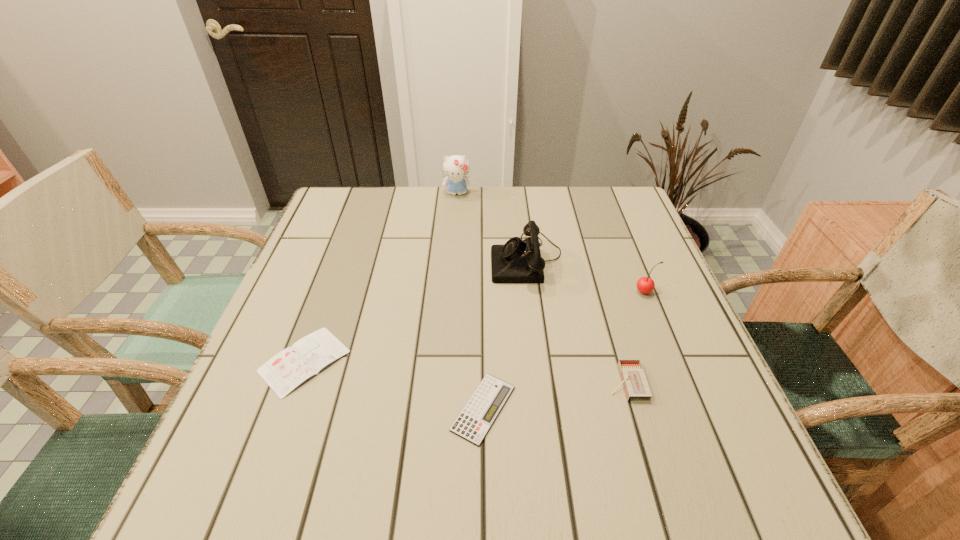
The image size is (960, 540). Find the location of `kitten located in the far edge section of the desktop`. kitten located in the far edge section of the desktop is located at coordinates pyautogui.click(x=456, y=167).

Where is `telephone located at the far edge`? The height and width of the screenshot is (540, 960). telephone located at the far edge is located at coordinates (517, 261).

Identify the location of object at the left edge. (292, 366).

I want to click on cherry at the right edge, so click(645, 285).

I want to click on matchbox that is positioned at the right edge, so click(x=634, y=381).

Locate an element on the screen. vacant point at the far edge is located at coordinates (394, 198).

This screenshot has height=540, width=960. In the image, there is a desktop. What are the coordinates of `vacant area at the near edge` in the screenshot? It's located at point(464,463).

The width and height of the screenshot is (960, 540). In the image, there is a desktop. Identify the location of vacant space at the left edge. (303, 295).

You are a GUI agent. You are given a task and a screenshot of the screen. Output one action in this format:
    pyautogui.click(x=<x>, y=<y>)
    Task: Click on the free region at the right edge
    The image size is (960, 540).
    Given the screenshot: What is the action you would take?
    pyautogui.click(x=650, y=260)

Where is `vacant space at the far left corner of the desktop`? This screenshot has width=960, height=540. vacant space at the far left corner of the desktop is located at coordinates (346, 208).